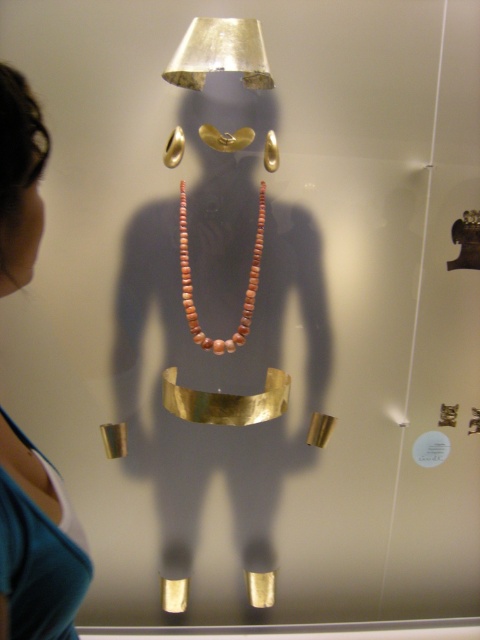
Question: Which object appears farthest from the camera in this image?

Choices:
 (A) teal fabric top at left
 (B) metallic gold bracelet at upper center
 (C) matte coral necklace at center

Answer: (C)

Question: Estimate the real-world distances between objects in this image. Which object is farther from the matte coral necklace at center?

Choices:
 (A) metallic gold bracelet at upper center
 (B) teal fabric top at left

Answer: (B)

Question: Which object is the closest to the teal fabric top at left?

Choices:
 (A) matte coral necklace at center
 (B) metallic gold bracelet at upper center

Answer: (A)

Question: Is teal fabric top at left further to camera compared to metallic gold bracelet at upper center?

Choices:
 (A) no
 (B) yes

Answer: (A)

Question: Is metallic gold bracelet at upper center positioned at the back of matte coral necklace at center?

Choices:
 (A) no
 (B) yes

Answer: (A)

Question: Can you confirm if teal fabric top at left is positioned below metallic gold bracelet at upper center?

Choices:
 (A) yes
 (B) no

Answer: (A)